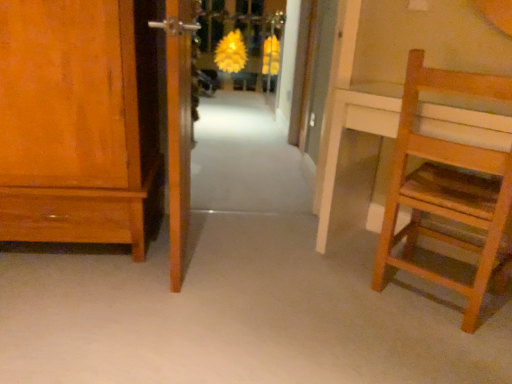
Question: From a real-world perspective, is white carpet at center above or below wooden door at center, the 1th door positioned from the right?

Choices:
 (A) above
 (B) below

Answer: (B)

Question: Relative to wooden door at center, positioned as the second door in front-to-back order, is white carpet at center in front or behind?

Choices:
 (A) front
 (B) behind

Answer: (A)

Question: Which is nearer to the wooden door at center, the 1th door positioned from the right?

Choices:
 (A) yellow matte flower at center
 (B) white carpet at center
 (C) wooden floor at center
 (D) matte wood cabinet at left
 (E) wooden door at left, acting as the first door starting from the front

Answer: (B)

Question: Which object is the farthest from the yellow matte flower at center?

Choices:
 (A) wooden floor at center
 (B) light brown wooden chair at right
 (C) white carpet at center
 (D) matte wood cabinet at left
 (E) wooden door at left, acting as the first door starting from the front

Answer: (A)